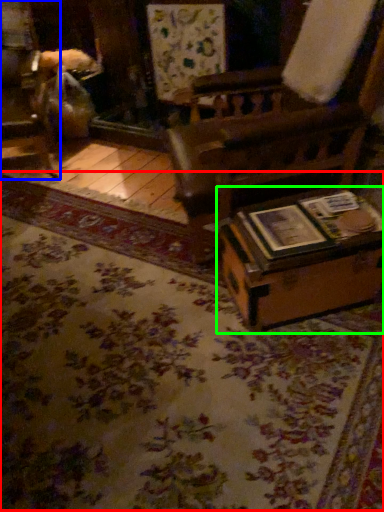
Question: Estimate the real-world distances between objects in this image. Which object is closer to mat (highlighted by a red box), furniture (highlighted by a blue box) or table (highlighted by a green box)?

Choices:
 (A) furniture
 (B) table

Answer: (B)